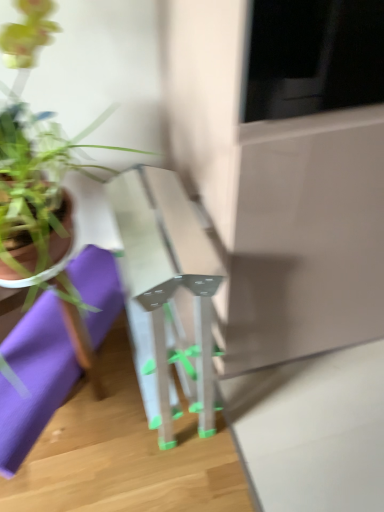
Question: Would you say purple fabric at lower left is to the left or to the right of transparent plastic table at center in the picture?

Choices:
 (A) right
 (B) left

Answer: (B)

Question: Is purple fabric at lower left taller or shorter than transparent plastic table at center?

Choices:
 (A) short
 (B) tall

Answer: (A)

Question: Based on their relative distances, which object is farther from the purple fabric at lower left?

Choices:
 (A) transparent plastic table at center
 (B) green matte plant pot at left

Answer: (B)

Question: Which of these objects is positioned closest to the transparent plastic table at center?

Choices:
 (A) green matte plant pot at left
 (B) purple fabric at lower left

Answer: (B)